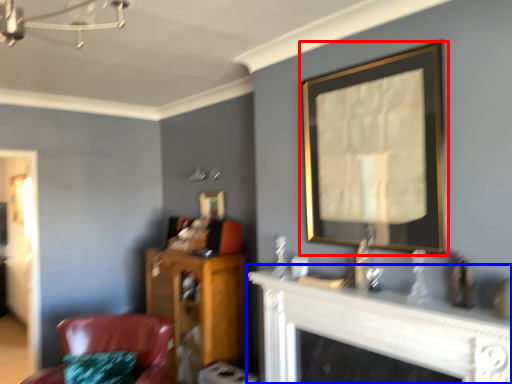
Question: Which of the following is the closest to the observer, picture frame (highlighted by a red box) or fireplace (highlighted by a blue box)?

Choices:
 (A) picture frame
 (B) fireplace

Answer: (B)